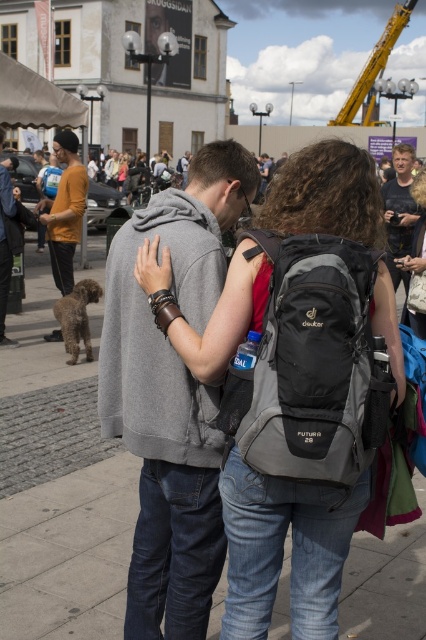
Question: Which point is closer to the camera?

Choices:
 (A) yellow metallic crane at upper right
 (B) gray fabric backpack at center

Answer: (B)

Question: Does denim backpack at center have a smaller size compared to matte black backpack at center?

Choices:
 (A) yes
 (B) no

Answer: (B)

Question: Observing the image, what is the correct spatial positioning of gray sweatshirt at center in reference to yellow metallic crane at upper right?

Choices:
 (A) below
 (B) above

Answer: (A)

Question: Based on their relative distances, which object is farther from the yellow metallic crane at upper right?

Choices:
 (A) matte yellow shirt at left
 (B) gray sweatshirt at center

Answer: (B)

Question: Estimate the real-world distances between objects in this image. Which object is closer to the yellow metallic crane at upper right?

Choices:
 (A) matte black backpack at center
 (B) gray fabric backpack at center

Answer: (A)

Question: Does matte yellow shirt at left come in front of dark gray hoodie at center?

Choices:
 (A) yes
 (B) no

Answer: (B)